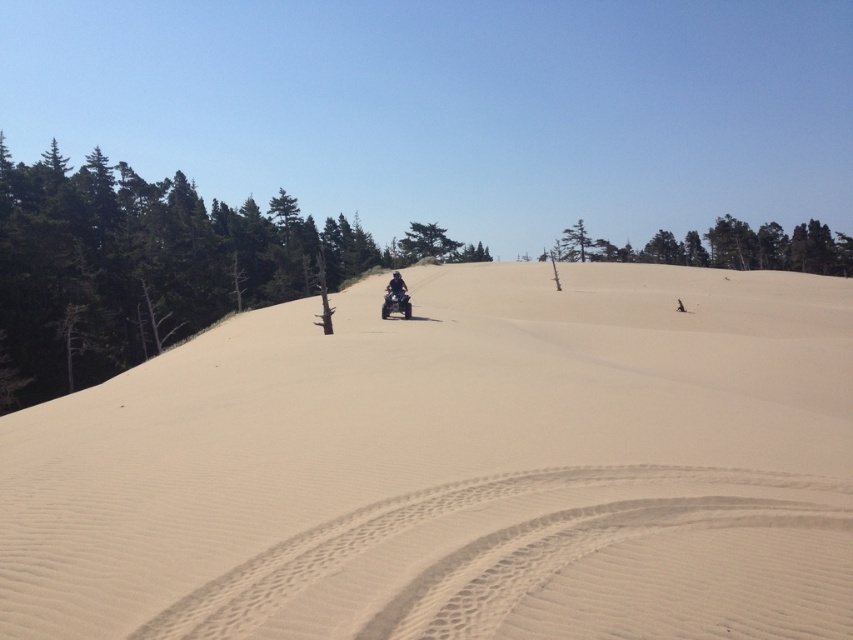
Question: Observing the image, what is the correct spatial positioning of green textured tree at upper center in reference to green textured tree at center?

Choices:
 (A) above
 (B) below

Answer: (B)

Question: Is green textured tree at center further to camera compared to dark gray fabric jacket at center?

Choices:
 (A) no
 (B) yes

Answer: (B)

Question: Which point is closer to the camera?

Choices:
 (A) dark gray fabric jacket at center
 (B) smooth sand dune at center

Answer: (B)

Question: Which point is closer to the camera?

Choices:
 (A) green textured tree at center
 (B) green textured tree at upper center

Answer: (B)

Question: Which of the following is the closest to the observer?

Choices:
 (A) (396, 275)
 (B) (16, 250)
 (C) (538, 576)

Answer: (C)

Question: Is green textured tree at upper center wider than dark gray fabric jacket at center?

Choices:
 (A) no
 (B) yes

Answer: (B)